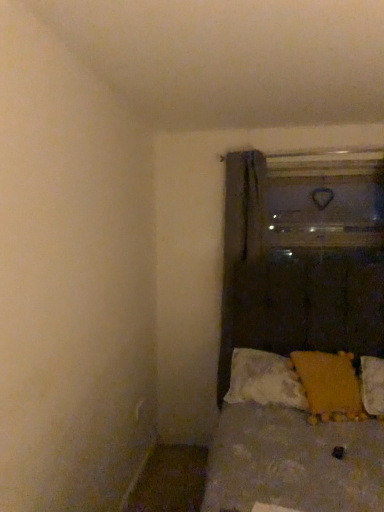
Question: Considering the relative positions of transparent glass door at upper right and yellow fabric pillow at lower right, placed as the second pillow when sorted from left to right, in the image provided, is transparent glass door at upper right to the right of yellow fabric pillow at lower right, placed as the second pillow when sorted from left to right, from the viewer's perspective?

Choices:
 (A) yes
 (B) no

Answer: (A)

Question: From a real-world perspective, does transparent glass door at upper right stand above yellow fabric pillow at lower right, the first pillow viewed from the right?

Choices:
 (A) no
 (B) yes

Answer: (B)

Question: Is transparent glass door at upper right taller than yellow fabric pillow at lower right, placed as the second pillow when sorted from left to right?

Choices:
 (A) yes
 (B) no

Answer: (A)

Question: Is transparent glass door at upper right outside of yellow fabric pillow at lower right, placed as the second pillow when sorted from left to right?

Choices:
 (A) no
 (B) yes

Answer: (B)

Question: From the image's perspective, is transparent glass door at upper right located beneath yellow fabric pillow at lower right, the first pillow viewed from the right?

Choices:
 (A) no
 (B) yes

Answer: (A)

Question: Considering the positions of point (246, 328) and point (244, 389), is point (246, 328) closer or farther from the camera than point (244, 389)?

Choices:
 (A) farther
 (B) closer

Answer: (A)

Question: Is dark gray fabric curtain at center taller or shorter than white textured pillow at lower right, the first pillow positioned from the left?

Choices:
 (A) tall
 (B) short

Answer: (A)

Question: Is dark gray fabric curtain at center bigger or smaller than white textured pillow at lower right, the first pillow positioned from the left?

Choices:
 (A) big
 (B) small

Answer: (A)

Question: From the image's perspective, is dark gray fabric curtain at center positioned above or below white textured pillow at lower right, the first pillow positioned from the left?

Choices:
 (A) above
 (B) below

Answer: (A)

Question: In the image, is yellow fabric pillow at lower right, placed as the second pillow when sorted from left to right, positioned in front of or behind transparent glass door at upper right?

Choices:
 (A) behind
 (B) front

Answer: (B)

Question: From a real-world perspective, is yellow fabric pillow at lower right, placed as the second pillow when sorted from left to right, positioned above or below transparent glass door at upper right?

Choices:
 (A) below
 (B) above

Answer: (A)

Question: Is point (294, 362) positioned closer to the camera than point (379, 186)?

Choices:
 (A) farther
 (B) closer

Answer: (B)

Question: Considering the positions of yellow fabric pillow at lower right, placed as the second pillow when sorted from left to right, and transparent glass door at upper right in the image, is yellow fabric pillow at lower right, placed as the second pillow when sorted from left to right, taller or shorter than transparent glass door at upper right?

Choices:
 (A) tall
 (B) short

Answer: (B)

Question: Is yellow fabric pillow at lower right, the first pillow viewed from the right, taller or shorter than white textured pillow at lower right, the 2th pillow from the right?

Choices:
 (A) tall
 (B) short

Answer: (A)

Question: In the image, is yellow fabric pillow at lower right, placed as the second pillow when sorted from left to right, positioned in front of or behind white textured pillow at lower right, the first pillow positioned from the left?

Choices:
 (A) front
 (B) behind

Answer: (A)